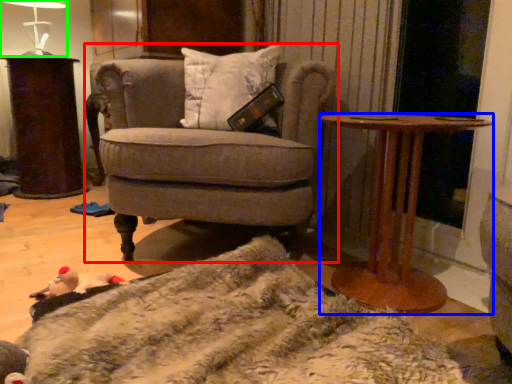
Question: Considering the real-world distances, which object is closest to chair (highlighted by a red box)? table (highlighted by a blue box) or table lamp (highlighted by a green box).

Choices:
 (A) table
 (B) table lamp

Answer: (A)